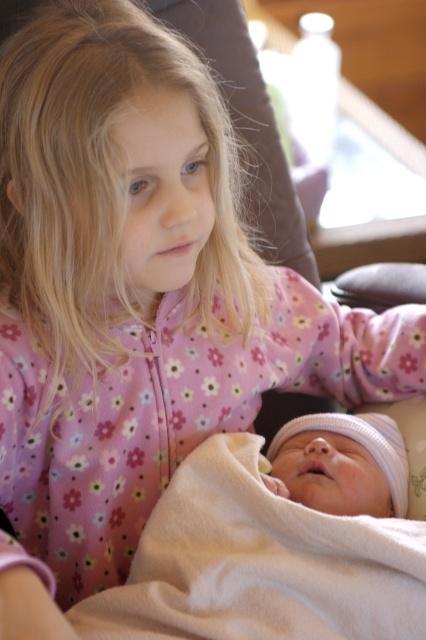
Question: Which point appears farthest from the camera in this image?

Choices:
 (A) (354, 550)
 (B) (291, 445)

Answer: (B)

Question: Is white fleece blanket at lower center to the right of soft white blanket at center from the viewer's perspective?

Choices:
 (A) yes
 (B) no

Answer: (B)

Question: Is the position of white fleece blanket at lower center more distant than that of soft white blanket at center?

Choices:
 (A) yes
 (B) no

Answer: (B)

Question: Does white fleece blanket at lower center have a larger size compared to soft white blanket at center?

Choices:
 (A) no
 (B) yes

Answer: (B)

Question: Which object is farther from the camera taking this photo?

Choices:
 (A) soft white blanket at center
 (B) white fleece blanket at lower center

Answer: (A)